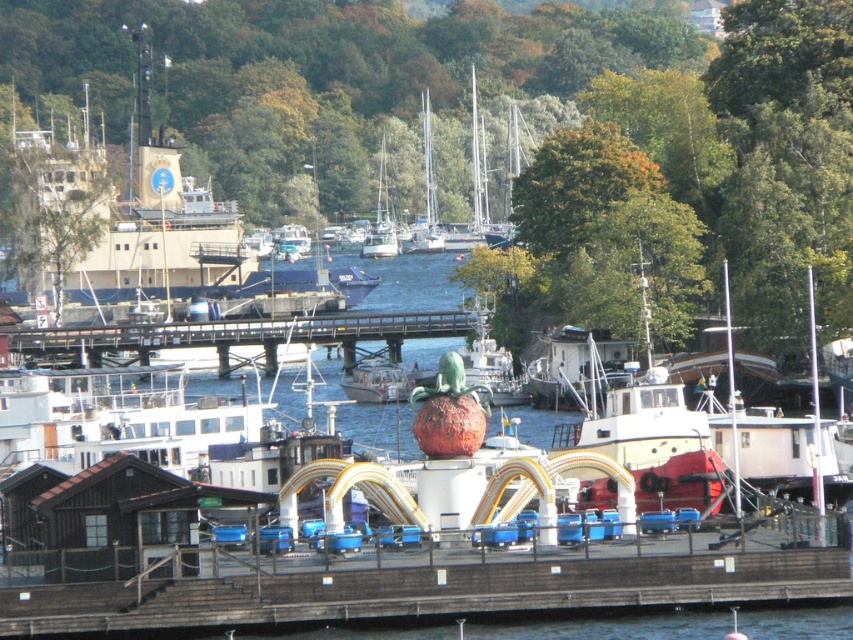
Question: Which point appears farthest from the camera in this image?

Choices:
 (A) (699, 442)
 (B) (769, 477)
 (C) (369, 241)

Answer: (C)

Question: Can you confirm if brown wooden dock at center is positioned above white glossy sailboat at center?

Choices:
 (A) no
 (B) yes

Answer: (A)

Question: Which of these objects is positioned closest to the red matte tugboat at center?

Choices:
 (A) white glossy sailboat at center
 (B) wooden dock at center

Answer: (B)

Question: Is wooden dock at center closer to camera compared to white matte boat at right?

Choices:
 (A) no
 (B) yes

Answer: (A)

Question: Which object appears farthest from the camera in this image?

Choices:
 (A) wooden dock at center
 (B) white matte boat at right
 (C) red matte tugboat at center
 (D) brown wooden dock at center

Answer: (A)

Question: From the image, what is the correct spatial relationship of brown wooden dock at center in relation to white matte boat at right?

Choices:
 (A) above
 (B) below

Answer: (B)